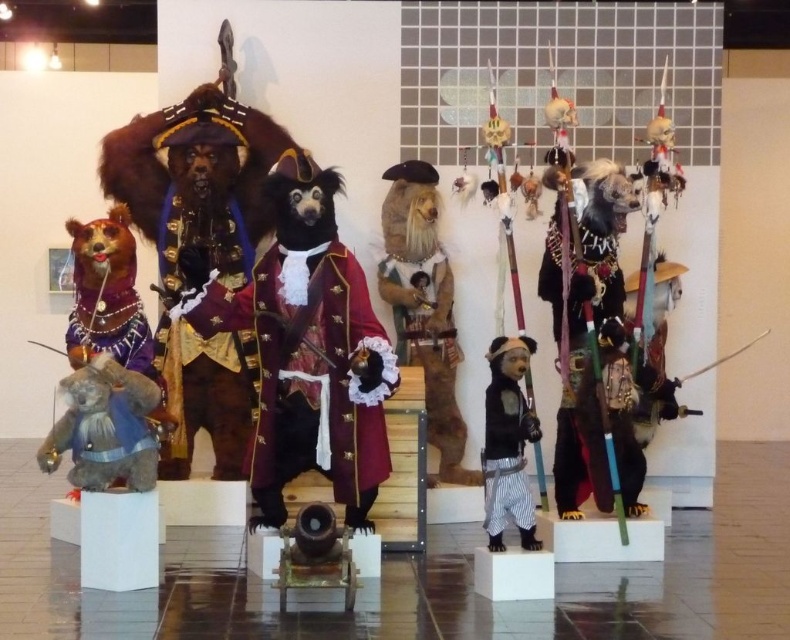
How distant is furry costume at center from matte black bear at center?

The distance of furry costume at center from matte black bear at center is 38.59 inches.

Is furry costume at center above matte black bear at center?

Yes, furry costume at center is above matte black bear at center.

Does point (416, 180) come closer to viewer compared to point (503, 490)?

No.

You are a GUI agent. You are given a task and a screenshot of the screen. Output one action in this format:
    pyautogui.click(x=<x>, y=<y>)
    Task: Click on the furry costume at center
    This screenshot has width=790, height=640.
    Given the screenshot: What is the action you would take?
    pyautogui.click(x=424, y=305)

Is fuzzy brown teddy bear at left to the right of matte black bear at center from the viewer's perspective?

In fact, fuzzy brown teddy bear at left is to the left of matte black bear at center.

Does fuzzy brown teddy bear at left have a larger size compared to matte black bear at center?

Yes, fuzzy brown teddy bear at left is bigger than matte black bear at center.

Identify the location of fuzzy brown teddy bear at left. (104, 428).

The height and width of the screenshot is (640, 790). What are the coordinates of `fuzzy brown teddy bear at left` in the screenshot? It's located at (104, 428).

Does velvet maroon coat at center have a lesser width compared to matte black bear at center?

Incorrect, velvet maroon coat at center's width is not less than matte black bear at center's.

Which is above, velvet maroon coat at center or matte black bear at center?

velvet maroon coat at center

Which is in front, point (369, 356) or point (521, 524)?

Positioned in front is point (369, 356).

The height and width of the screenshot is (640, 790). In order to click on velvet maroon coat at center in this screenshot , I will do `click(309, 349)`.